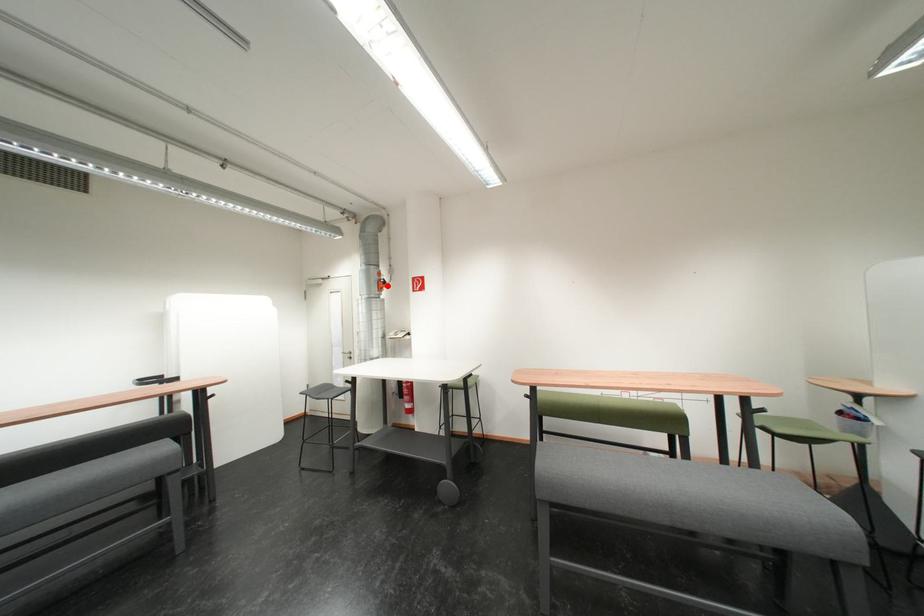
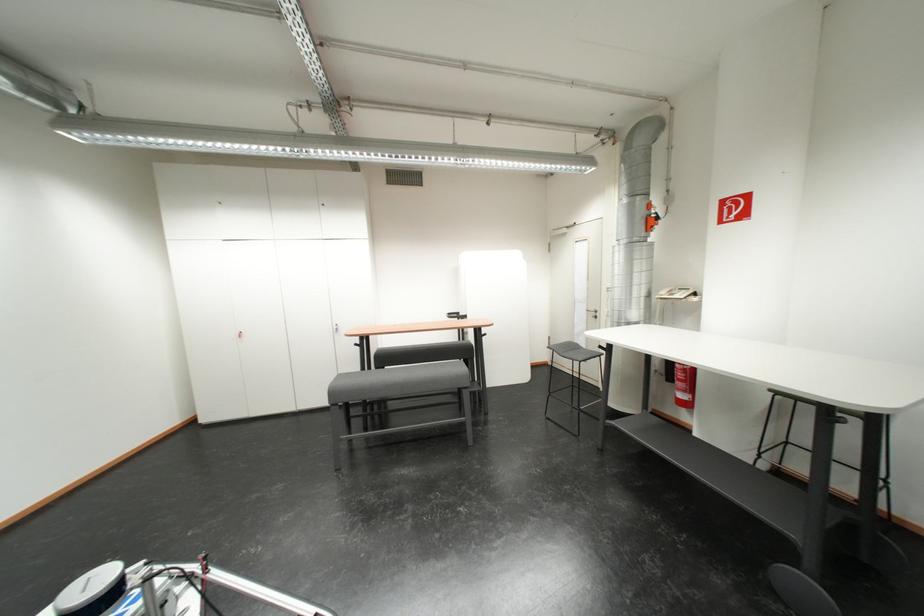
Find the pixel in the second image that matches the highlighted location in the first image.

(654, 224)